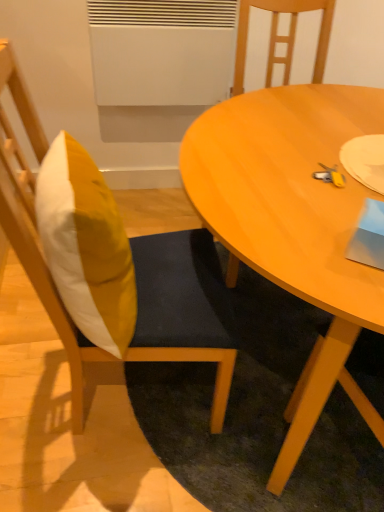
Question: Is yellow fabric pillow at left completely or partially outside of wooden chair at center, the second chair positioned from the left?

Choices:
 (A) yes
 (B) no

Answer: (A)

Question: Is the position of yellow fabric pillow at left less distant than that of wooden chair at center, which is the 1th chair in right-to-left order?

Choices:
 (A) yes
 (B) no

Answer: (A)

Question: Can wooden chair at center, the second chair positioned from the left, be found inside yellow fabric pillow at left?

Choices:
 (A) no
 (B) yes

Answer: (A)

Question: Considering the relative sizes of yellow fabric pillow at left and wooden chair at center, the second chair positioned from the left, in the image provided, is yellow fabric pillow at left shorter than wooden chair at center, the second chair positioned from the left,?

Choices:
 (A) yes
 (B) no

Answer: (A)

Question: Can you confirm if yellow fabric pillow at left is wider than wooden chair at center, the second chair positioned from the left?

Choices:
 (A) no
 (B) yes

Answer: (A)

Question: Is yellow fabric pillow at left taller or shorter than wooden chair at left, which appears as the first chair when viewed from the left?

Choices:
 (A) tall
 (B) short

Answer: (B)

Question: In terms of size, does yellow fabric pillow at left appear bigger or smaller than wooden chair at left, acting as the second chair starting from the right?

Choices:
 (A) small
 (B) big

Answer: (A)

Question: Does point (36, 210) appear closer or farther from the camera than point (13, 221)?

Choices:
 (A) closer
 (B) farther

Answer: (A)

Question: Is yellow fabric pillow at left spatially inside wooden chair at left, which appears as the first chair when viewed from the left, or outside of it?

Choices:
 (A) outside
 (B) inside

Answer: (B)

Question: Is wooden chair at center, the second chair positioned from the left, spatially inside wooden chair at left, which appears as the first chair when viewed from the left, or outside of it?

Choices:
 (A) inside
 (B) outside

Answer: (B)

Question: From a real-world perspective, is wooden chair at center, which is the 1th chair in right-to-left order, positioned above or below wooden chair at left, which appears as the first chair when viewed from the left?

Choices:
 (A) below
 (B) above

Answer: (A)

Question: Is wooden chair at center, the second chair positioned from the left, to the left or to the right of wooden chair at left, which appears as the first chair when viewed from the left, in the image?

Choices:
 (A) left
 (B) right

Answer: (B)

Question: From the image's perspective, is wooden chair at center, the second chair positioned from the left, positioned above or below wooden chair at left, which appears as the first chair when viewed from the left?

Choices:
 (A) above
 (B) below

Answer: (A)

Question: Based on their positions, is wooden chair at left, acting as the second chair starting from the right, located to the left or right of yellow fabric pillow at left?

Choices:
 (A) right
 (B) left

Answer: (A)

Question: From the image's perspective, is wooden chair at left, acting as the second chair starting from the right, above or below yellow fabric pillow at left?

Choices:
 (A) below
 (B) above

Answer: (A)